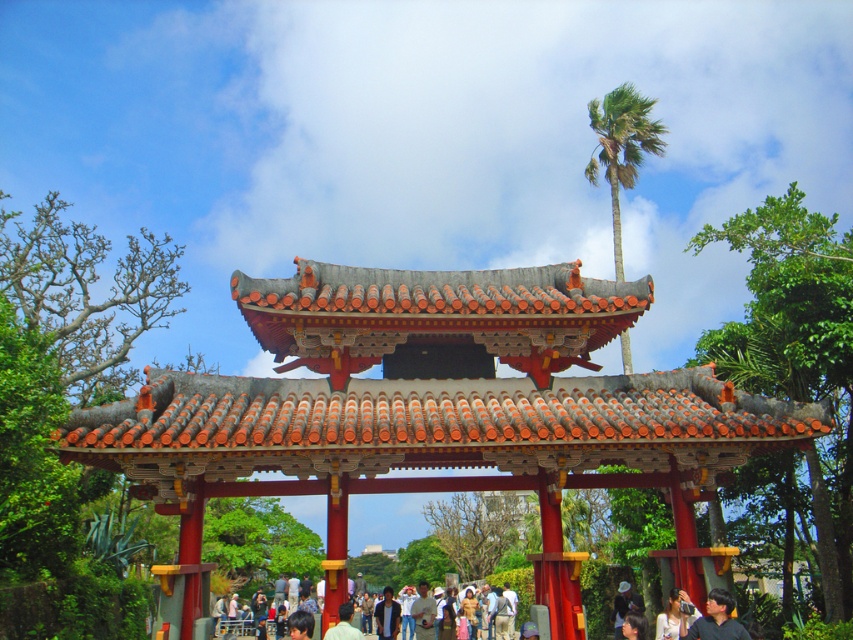
Question: Can you confirm if matte orange tile gate at center is thinner than green leafy palm at upper right?

Choices:
 (A) yes
 (B) no

Answer: (B)

Question: Among these points, which one is farthest from the camera?

Choices:
 (A) (804, 440)
 (B) (697, 637)
 (C) (663, 637)

Answer: (C)

Question: Is matte black shirt at lower right closer to camera compared to matte black camera at lower right?

Choices:
 (A) yes
 (B) no

Answer: (A)

Question: Which point is farther to the camera?

Choices:
 (A) matte black camera at lower right
 (B) matte black shirt at lower right
 (C) matte orange tile gate at center
 (D) green leafy palm at upper right

Answer: (D)

Question: Which point is farther to the camera?

Choices:
 (A) (595, 164)
 (B) (538, 452)
 (C) (664, 611)

Answer: (A)

Question: Can you confirm if matte black shirt at lower right is positioned above light brown fabric bag at lower center?

Choices:
 (A) yes
 (B) no

Answer: (A)